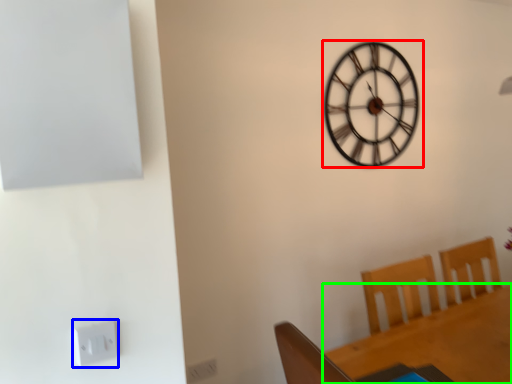
Question: Estimate the real-world distances between objects in this image. Which object is farther from wall clock (highlighted by a red box), electric outlet (highlighted by a blue box) or round table (highlighted by a green box)?

Choices:
 (A) electric outlet
 (B) round table

Answer: (A)